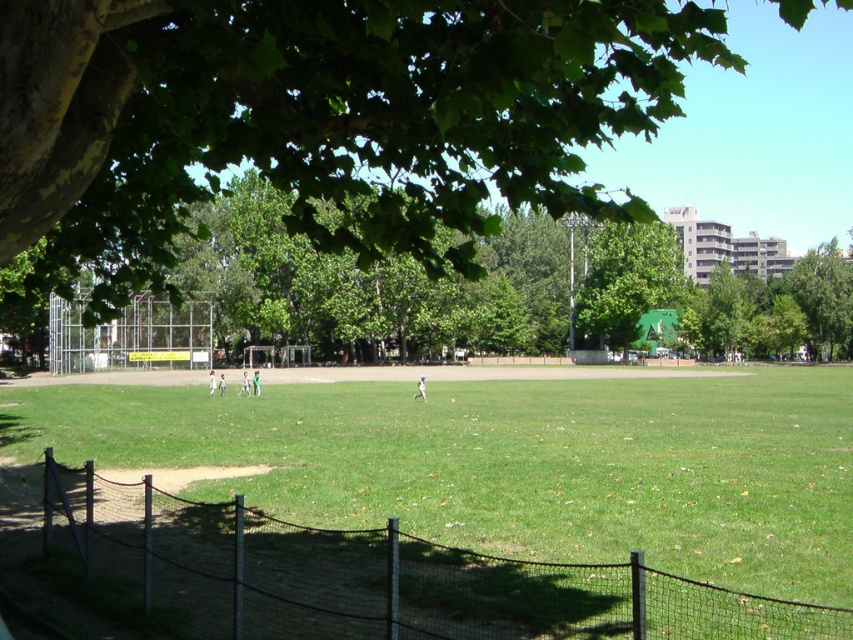
Identify the location of black mesh fence at lower left. (x=389, y=579).

Between point (263, 570) and point (585, 312), which one is positioned behind?

The point (585, 312) is behind.

This screenshot has height=640, width=853. Identify the location of black mesh fence at lower left. (389, 579).

Consider the image. Who is lower down, metallic wire fence at left or green leafy tree at center?

metallic wire fence at left

In the scene shown: Who is shorter, metallic wire fence at left or green leafy tree at center?

Standing shorter between the two is metallic wire fence at left.

Does point (73, 336) come behind point (614, 228)?

No, it is in front of (614, 228).

In order to click on metallic wire fence at left in this screenshot , I will do [131, 336].

Which of these two, green leafy tree at upper left or green leafy tree at center, stands shorter?

green leafy tree at center

Where is `green leafy tree at upper left`? Image resolution: width=853 pixels, height=640 pixels. green leafy tree at upper left is located at coordinates (320, 118).